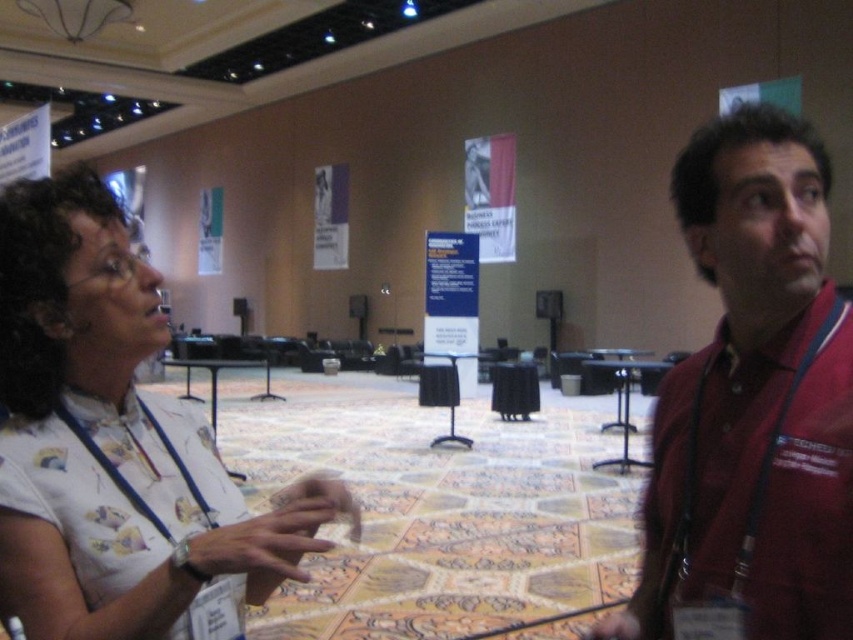
You are standing in the conference room and see a point marked at coordinates (x=117, y=445). Which object is this point located on?

The point at (x=117, y=445) is located on the white printed shirt at left.

You are organizing a photo shoot in this conference room and need to position two models wearing the white printed shirt at left and maroon fabric shirt at right. The camera you are using has a minimum focus distance of 70 centimeters. Will you be able to capture both models clearly in the same frame without moving the camera closer?

The distance between the white printed shirt at left and the maroon fabric shirt at right is 67.63 centimeters. Since the camera requires a minimum focus distance of 70 centimeters, the models are too close to each other. Moving the camera closer or adjusting their positions would be necessary to ensure both are in focus.

You are standing in the conference room and need to determine the relative positions of two points marked in the image. Which point, point 1 at coordinates (24, 310) or point 2 at coordinates (693, 502), is closer to you?

Point 1 at coordinates (24, 310) is closer to you than point 2 at coordinates (693, 502).